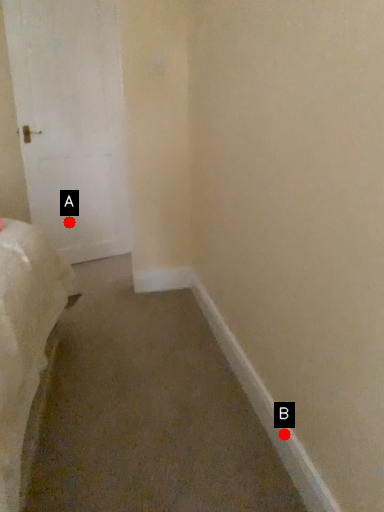
Question: Two points are circled on the image, labeled by A and B beside each circle. Which point appears farthest from the camera in this image?

Choices:
 (A) A is further
 (B) B is further

Answer: (A)